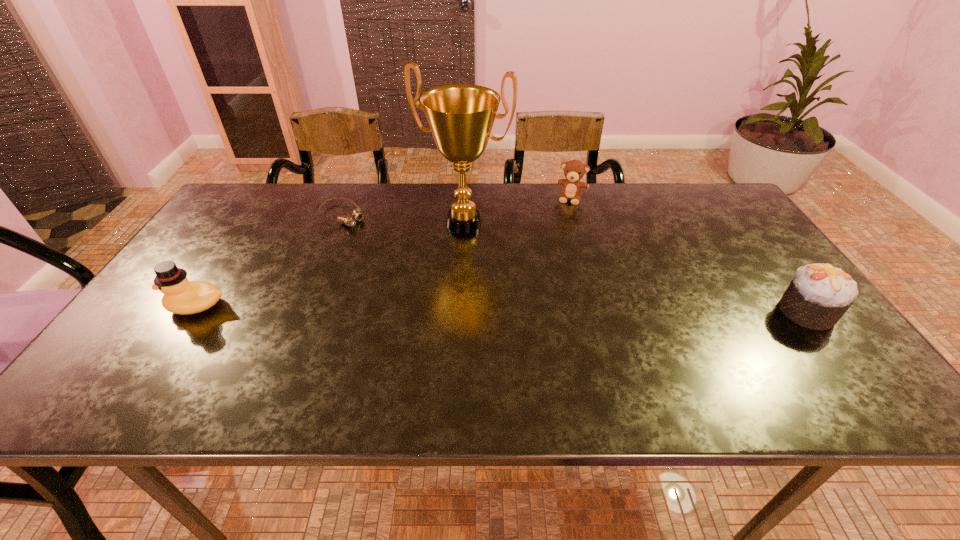
Identify the location of unoccupied position between the leftmost object and the goggles. This screenshot has height=540, width=960. (270, 260).

The height and width of the screenshot is (540, 960). I want to click on free spot between the cupcake and the leftmost object, so pos(502,308).

In order to click on blank region between the rightmost object and the award in this screenshot , I will do `click(636, 267)`.

Find the location of a particular element. This screenshot has height=540, width=960. unoccupied position between the leftmost object and the cupcake is located at coordinates (x=502, y=308).

This screenshot has width=960, height=540. I want to click on vacant space in between the duck and the teddy bear, so click(x=384, y=252).

At what (x,y) coordinates should I click in order to perform the action: click on free space between the shortest object and the leftmost object. Please return your answer as a coordinate pair (x, y). The width and height of the screenshot is (960, 540). Looking at the image, I should click on (270, 260).

Where is `vacant space that is in between the duck and the goggles`? This screenshot has height=540, width=960. vacant space that is in between the duck and the goggles is located at coordinates tap(270, 260).

The height and width of the screenshot is (540, 960). What are the coordinates of `free spot between the teddy bear and the leftmost object` in the screenshot? It's located at (384, 252).

At what (x,y) coordinates should I click in order to perform the action: click on the closest object to the second object from right to left. Please return your answer as a coordinate pair (x, y). The image size is (960, 540). Looking at the image, I should click on (460, 116).

Find the location of a particular element. The width and height of the screenshot is (960, 540). object that stands as the fourth closest to the award is located at coordinates (819, 295).